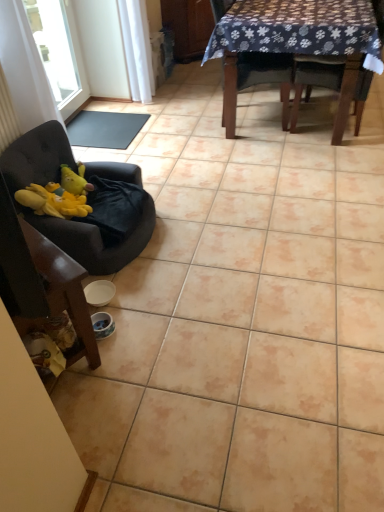
Image resolution: width=384 pixels, height=512 pixels. What are the coordinates of `free space in front of velvet dark gray chair at left, which is the 2th chair from left to right` in the screenshot? It's located at (157, 308).